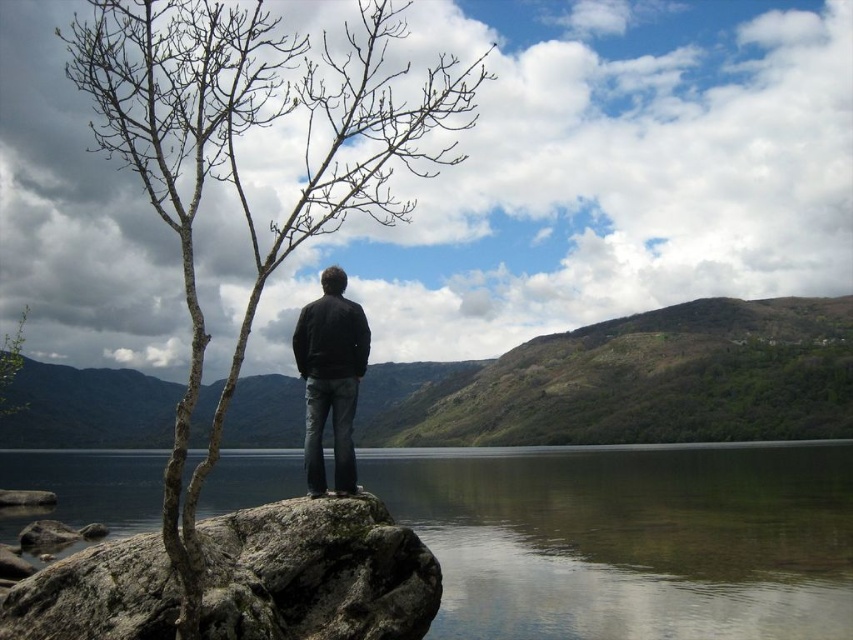
What is the 2D coordinate of the rough textured rock at lower left in the image?

The rough textured rock at lower left is located at the 2D coordinate point of (315, 572).